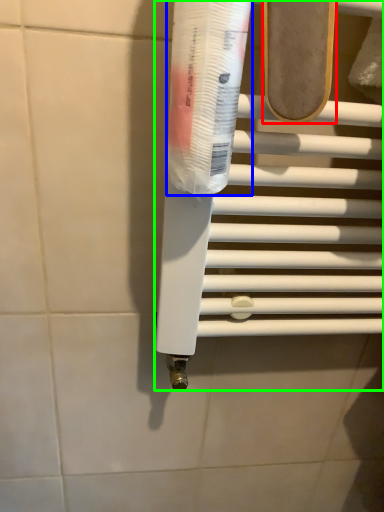
Question: Which object is positioned farthest from footwear (highlighted by a red box)? Select from toothpaste (highlighted by a blue box) and towel bar (highlighted by a green box).

Choices:
 (A) toothpaste
 (B) towel bar

Answer: (B)